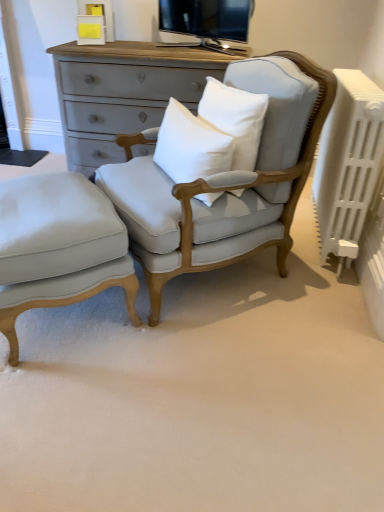
Question: Relative to white plastic radiator at right, is light gray fabric ottoman at lower left in front or behind?

Choices:
 (A) behind
 (B) front

Answer: (B)

Question: From a real-world perspective, relative to white plastic radiator at right, is light gray fabric ottoman at lower left vertically above or below?

Choices:
 (A) below
 (B) above

Answer: (A)

Question: Which of these objects is positioned farthest from the white plastic radiator at right?

Choices:
 (A) white cotton pillow at center, the first pillow in the left-to-right sequence
 (B) light gray fabric ottoman at lower left
 (C) white cotton pillow at center, which appears as the first pillow when viewed from the right
 (D) light gray fabric chair at center

Answer: (B)

Question: Which object is the closest to the light gray fabric ottoman at lower left?

Choices:
 (A) white cotton pillow at center, the second pillow in the left-to-right sequence
 (B) light gray fabric chair at center
 (C) white cotton pillow at center, the 2th pillow in the right-to-left sequence
 (D) white plastic radiator at right

Answer: (B)